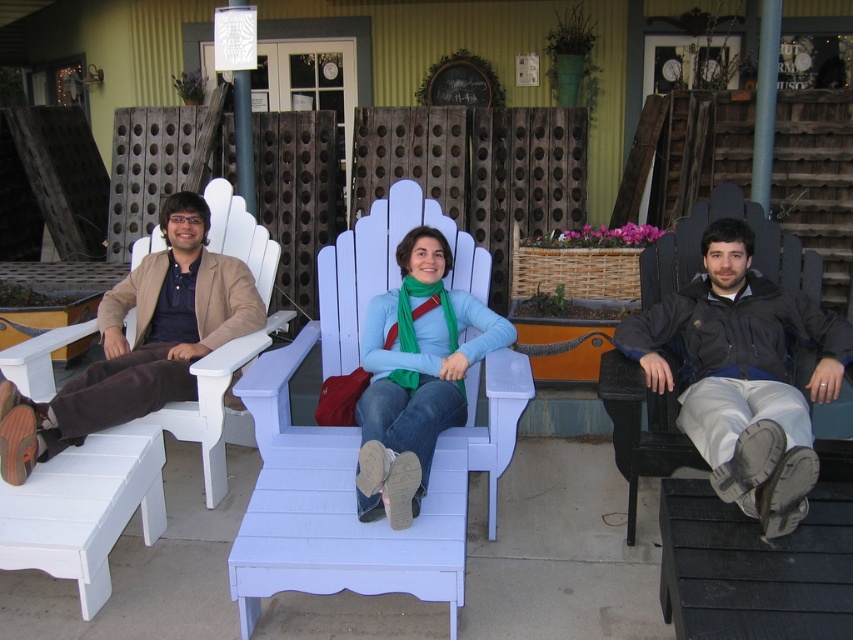
Based on the photo, you are a tailor who needs to determine which item requires more fabric to make between the matte brown jacket at left and the matte green scarf at center. Based on the image, which one would need more fabric?

The matte brown jacket at left requires more fabric than the matte green scarf at center because it has a larger size.

You are standing in front of the chairs and want to place a small plant between the white wood chair at center and the matte brown jacket at left. Based on their positions, which object is closer to you where you should place the plant?

The white wood chair at center is closer to the viewer than the matte brown jacket at left, so you should place the plant near the white wood chair at center.